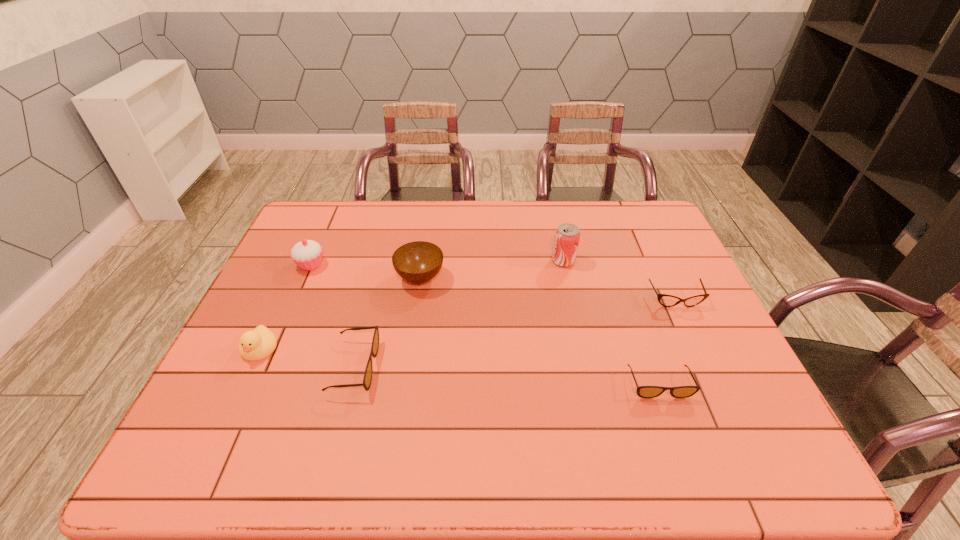
The image size is (960, 540). In the image, there is a desktop. In order to click on vacant area at the far edge in this screenshot , I will do `click(440, 203)`.

Where is `free space at the near edge of the desktop`? Image resolution: width=960 pixels, height=540 pixels. free space at the near edge of the desktop is located at coordinates (323, 409).

Identify the location of blank space at the left edge of the desktop. coord(325,259).

Identify the location of vacant space at the right edge of the desktop. (669, 325).

Image resolution: width=960 pixels, height=540 pixels. In the image, there is a desktop. What are the coordinates of `vacant space at the far right corner` in the screenshot? It's located at (635, 239).

Locate an element on the screen. free spot between the duckling and the cupcake is located at coordinates (285, 307).

You are a GUI agent. You are given a task and a screenshot of the screen. Output one action in this format:
    pyautogui.click(x=<x>, y=<y>)
    Task: Click on the free space between the shorter sunglasses and the fourth object from left to right
    This screenshot has height=540, width=960.
    Given the screenshot: What is the action you would take?
    pyautogui.click(x=540, y=331)

Image resolution: width=960 pixels, height=540 pixels. I want to click on free area in between the right sunglasses and the bowl, so click(540, 331).

I want to click on blank region between the duckling and the shorter sunglasses, so click(459, 366).

At what (x,y) coordinates should I click in order to perform the action: click on empty location between the cupcake and the right sunglasses. Please return your answer as a coordinate pair (x, y). Looking at the image, I should click on (485, 325).